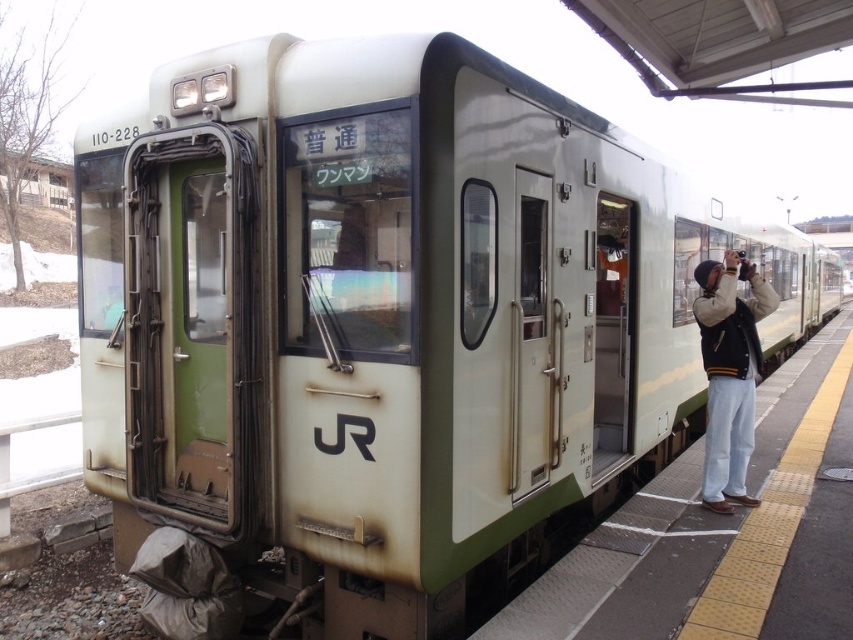
Can you confirm if smooth concrete platform at right is wider than khaki wool jacket at right?

Correct, the width of smooth concrete platform at right exceeds that of khaki wool jacket at right.

The width and height of the screenshot is (853, 640). What do you see at coordinates (627, 566) in the screenshot?
I see `smooth concrete platform at right` at bounding box center [627, 566].

This screenshot has height=640, width=853. Identify the location of smooth concrete platform at right. pos(627,566).